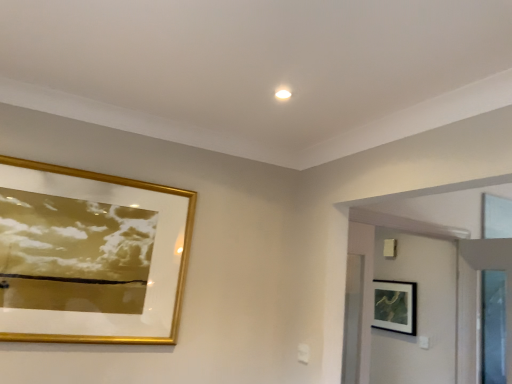
Question: Is black matte picture frame at upper right, which appears as the 1th picture frame when viewed from the right, inside the boundaries of white glossy door at upper right, or outside?

Choices:
 (A) outside
 (B) inside

Answer: (A)

Question: From the image's perspective, is black matte picture frame at upper right, which ranks as the 2th picture frame in front-to-back order, above or below white glossy door at upper right?

Choices:
 (A) below
 (B) above

Answer: (A)

Question: Which is nearer to the black matte picture frame at upper right, the first picture frame ordered from the bottom?

Choices:
 (A) white glossy door at upper right
 (B) gold/glass picture frame at upper left, which appears as the 1th picture frame when viewed from the top

Answer: (A)

Question: Considering the real-world distances, which object is farthest from the black matte picture frame at upper right, which ranks as the 2th picture frame in front-to-back order?

Choices:
 (A) white glossy door at upper right
 (B) gold/glass picture frame at upper left, which is counted as the 2th picture frame, starting from the bottom

Answer: (B)